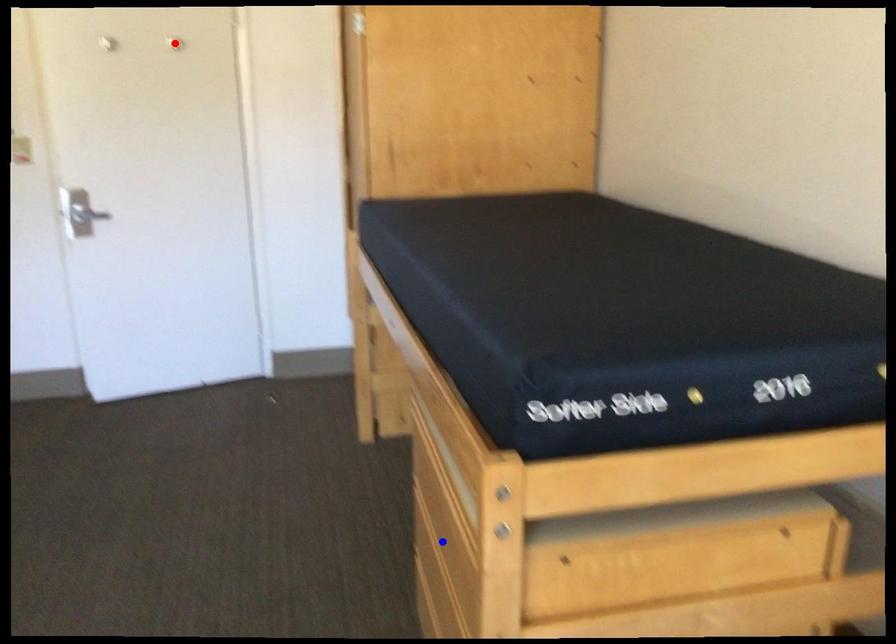
Question: In the image, two points are highlighted. Which point is nearer to the camera? Reply with the corresponding letter.

Choices:
 (A) blue point
 (B) red point

Answer: (A)